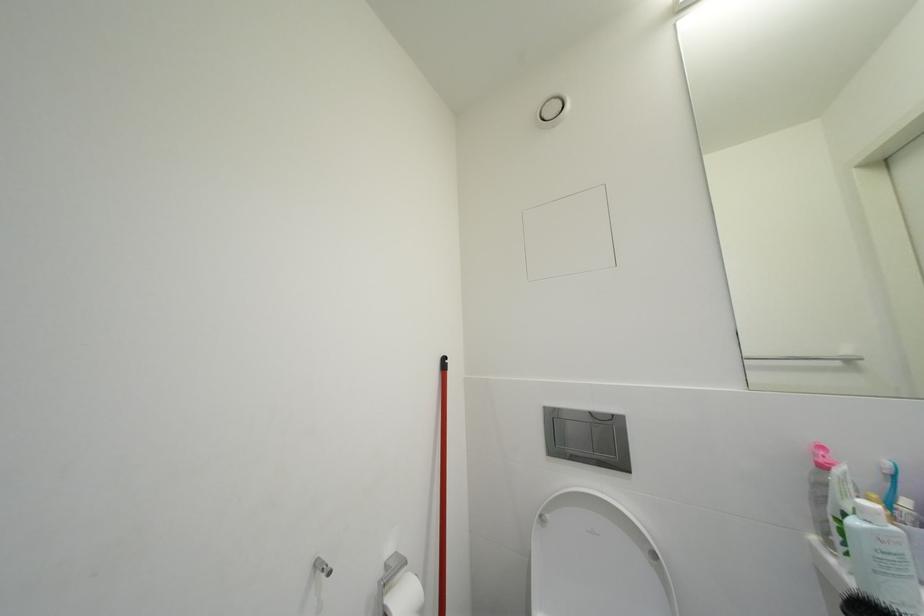
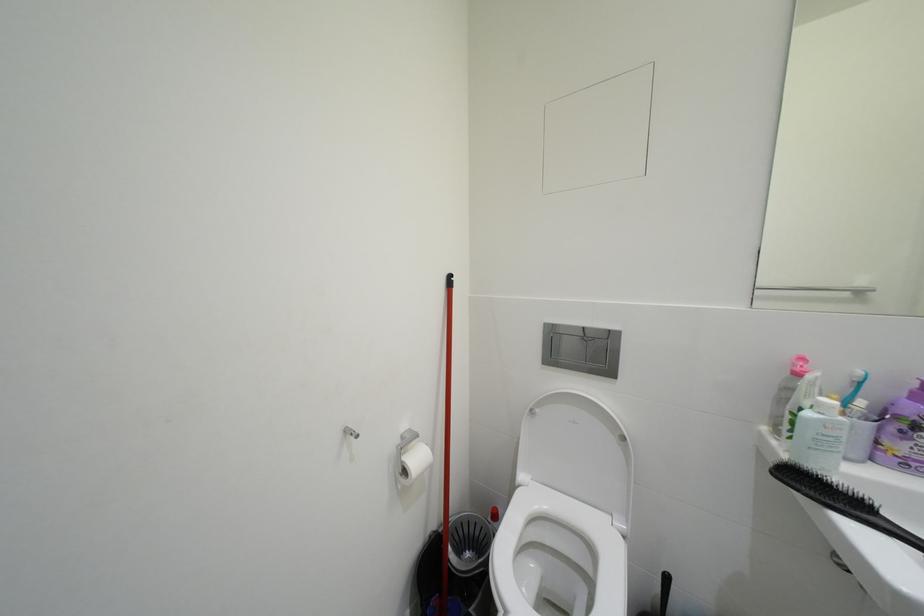
Question: In a continuous first-person perspective shot, in which direction is the camera moving?

Choices:
 (A) Left
 (B) Right
 (C) Forward
 (D) Backward

Answer: (A)